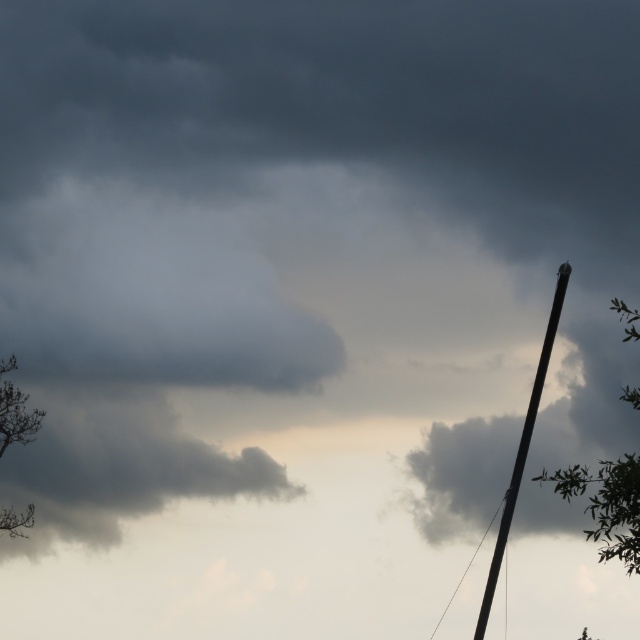
Identify the location of smooth metallic pole at right. (522, 449).

The width and height of the screenshot is (640, 640). Identify the location of smooth metallic pole at right. (522, 449).

Based on the photo, does green leafy tree at right have a smaller size compared to smooth metallic pole at right?

Yes, green leafy tree at right is smaller than smooth metallic pole at right.

Which is in front, point (632, 564) or point (532, 380)?

Point (632, 564) is in front.

The width and height of the screenshot is (640, 640). What do you see at coordinates (605, 504) in the screenshot? I see `green leafy tree at right` at bounding box center [605, 504].

Find the location of a particular element. green leafy tree at right is located at coordinates (605, 504).

Does dark gray cloud at center have a greater height compared to smooth metallic pole at right?

Incorrect, dark gray cloud at center's height is not larger of smooth metallic pole at right's.

Which is above, dark gray cloud at center or smooth metallic pole at right?

smooth metallic pole at right is above.

Who is more distant from viewer, (90,404) or (561,266)?

The point (90,404) is behind.

Image resolution: width=640 pixels, height=640 pixels. I want to click on dark gray cloud at center, so click(x=120, y=467).